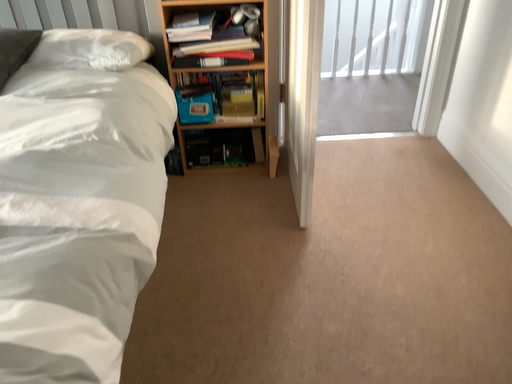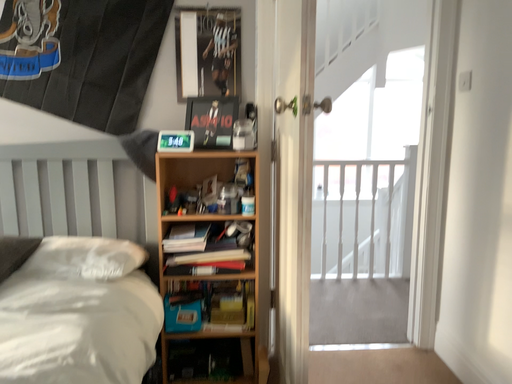
Question: Which way did the camera rotate in the video?

Choices:
 (A) rotated upward
 (B) rotated downward

Answer: (A)